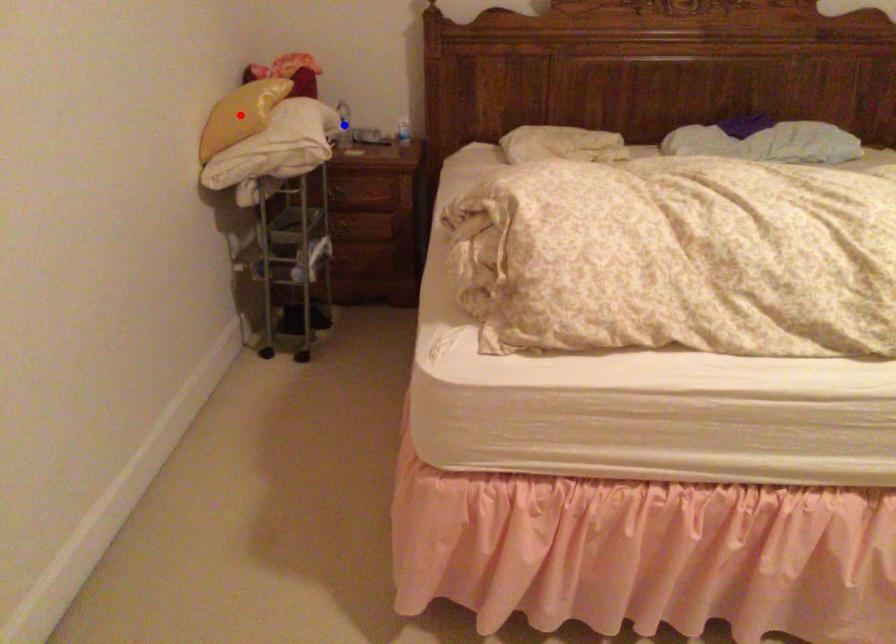
Question: In the image, two points are highlighted. Which point is nearer to the camera? Reply with the corresponding letter.

Choices:
 (A) blue point
 (B) red point

Answer: (B)